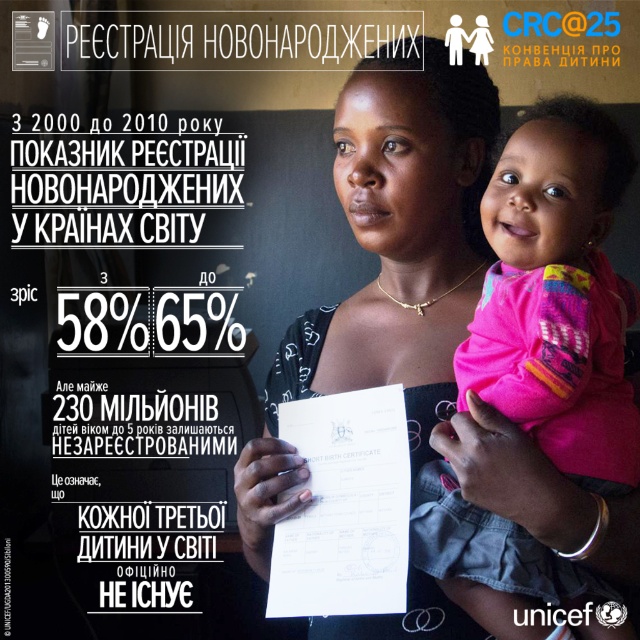
Between pink fabric baby at center and white paper at center, which one appears on the left side from the viewer's perspective?

white paper at center is more to the left.

What do you see at coordinates (557, 296) in the screenshot? I see `pink fabric baby at center` at bounding box center [557, 296].

Identify the location of pink fabric baby at center. (557, 296).